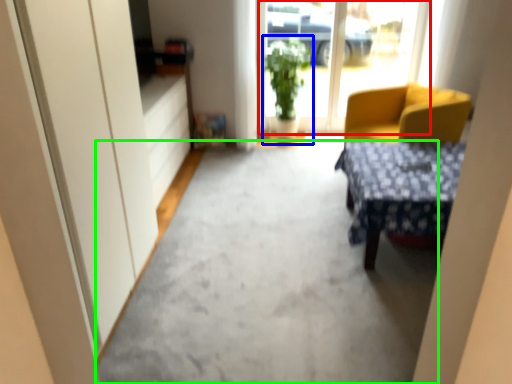
Question: Which object is the closest to the window screen (highlighted by a red box)? Choose among these: houseplant (highlighted by a blue box) or concrete (highlighted by a green box).

Choices:
 (A) houseplant
 (B) concrete

Answer: (A)